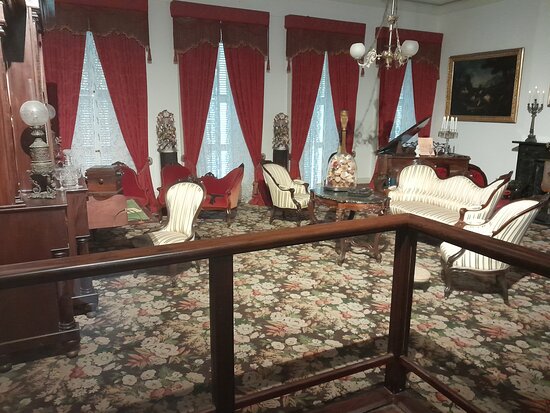
Locate an element on the screen. The width and height of the screenshot is (550, 413). chandelier is located at coordinates (359, 48), (412, 48), (389, 49).